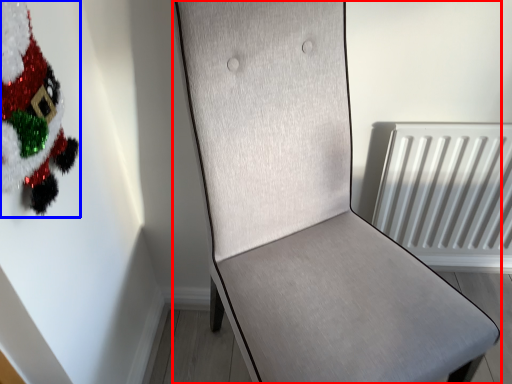
Question: Which of the following is the farthest to the observer, furniture (highlighted by a red box) or christmas tree (highlighted by a blue box)?

Choices:
 (A) furniture
 (B) christmas tree

Answer: (B)